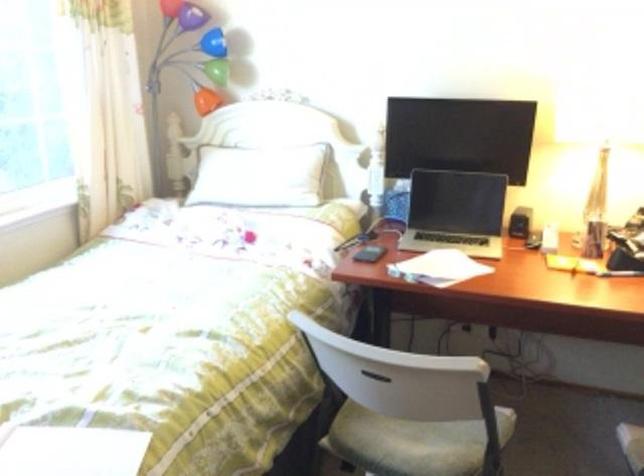
The height and width of the screenshot is (476, 644). What are the coordinates of `chair sitting surface` in the screenshot? It's located at (413, 442).